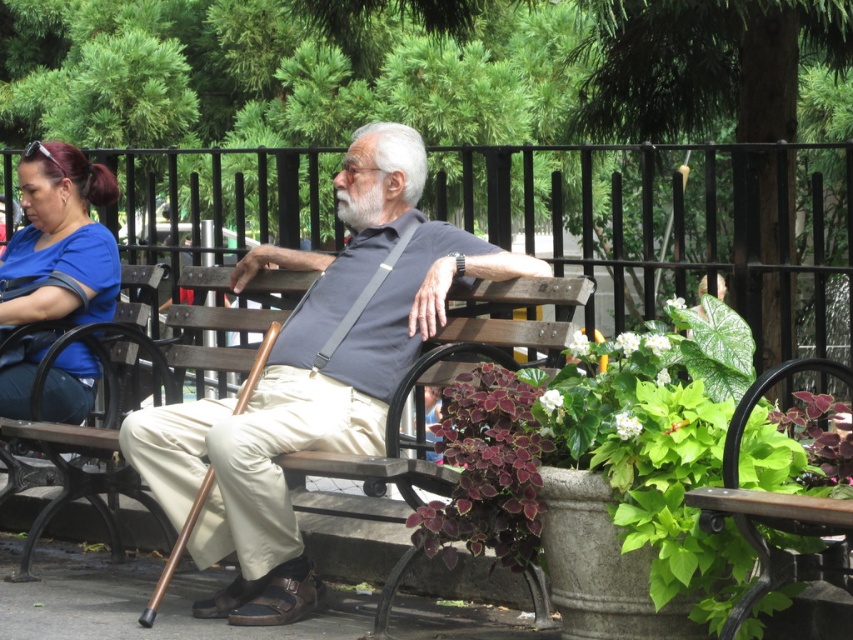
You are a park visitor who wants to place a small potted flower between the matte brown cane at center and the green leafy plant at lower right. Based on their positions, where should you place the flower so it is between both objects?

The matte brown cane at center is above the green leafy plant at lower right, so you should place the flower between them by positioning it below the matte brown cane at center and above the green leafy plant at lower right.

You are standing at point (x=666, y=435) and want to walk to the park entrance located at point (x=335, y=268). Is the entrance directly in front of you or behind you?

The entrance at point (x=335, y=268) is behind point (x=666, y=435), so it is behind you.